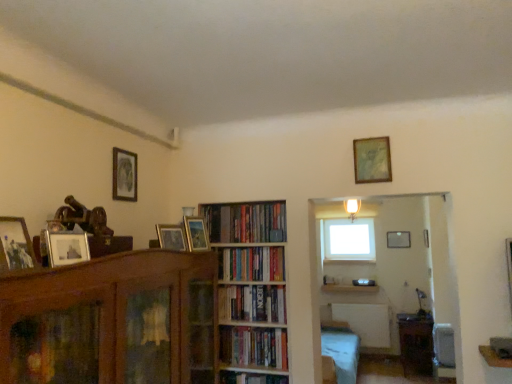
Question: Considering the relative positions of hardcover books at center, the 2th book from the bottom, and wooden bookshelf at center in the image provided, is hardcover books at center, the 2th book from the bottom, to the left or to the right of wooden bookshelf at center?

Choices:
 (A) left
 (B) right

Answer: (B)

Question: Is hardcover books at center, which appears as the third book when viewed from the top, bigger or smaller than wooden bookshelf at center?

Choices:
 (A) small
 (B) big

Answer: (A)

Question: Which is farther from the wooden picture frame at center, arranged as the third picture frame when viewed from the right?

Choices:
 (A) hardcover books at center, acting as the fourth book starting from the bottom
 (B) hardcover books at center, which ranks as the first book in bottom-to-top order
 (C) wooden picture frame at left, placed as the sixth picture frame when sorted from back to front
 (D) wooden picture frame at upper center, which ranks as the second picture frame in right-to-left order
 (E) brown wooden bookcase at left

Answer: (C)

Question: Considering the real-world distances, which object is farthest from the wooden picture frame at center, placed as the third picture frame when sorted from back to front?

Choices:
 (A) white glass window at upper center
 (B) wooden table at lower right
 (C) brown wooden bookcase at left
 (D) wooden picture frame at center, which is counted as the 3th picture frame, starting from the left
 (E) wooden bookshelf at center

Answer: (A)